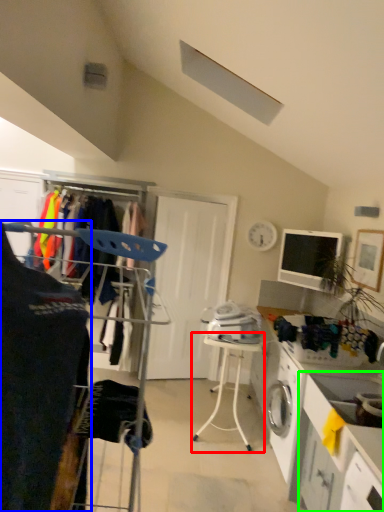
Question: Considering the real-world distances, which object is farthest from table (highlighted by a red box)? clothing (highlighted by a blue box) or counter (highlighted by a green box)?

Choices:
 (A) clothing
 (B) counter

Answer: (A)